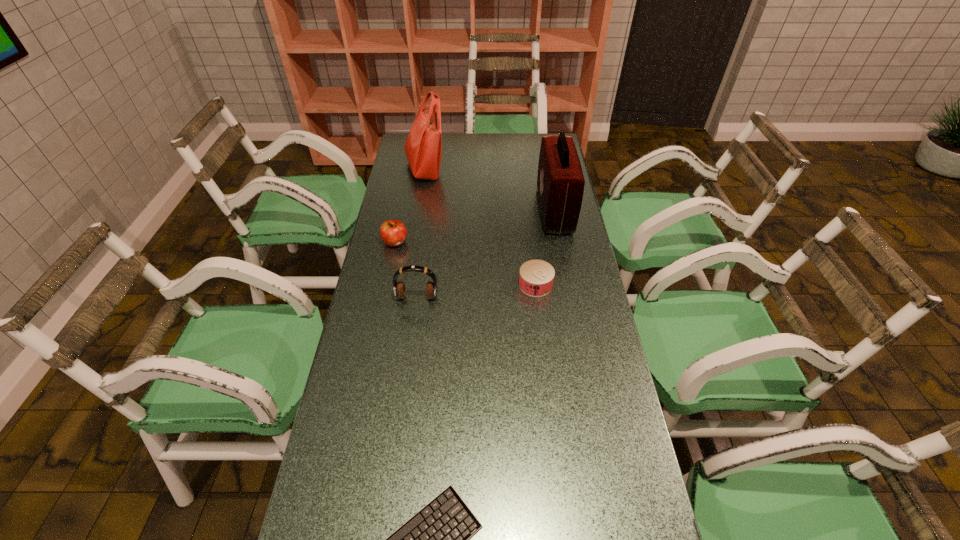
You are a GUI agent. You are given a task and a screenshot of the screen. Output one action in this format:
    pyautogui.click(x=<x>, y=<y>)
    Task: Click on the farthest object
    This screenshot has width=960, height=540.
    Given the screenshot: What is the action you would take?
    pyautogui.click(x=423, y=147)

Identify the location of the first aid kit. (560, 182).

You are a GUI agent. You are given a task and a screenshot of the screen. Output one action in this format:
    pyautogui.click(x=<x>, y=<y>)
    Task: Click on the headset
    The height and width of the screenshot is (540, 960).
    Given the screenshot: What is the action you would take?
    pyautogui.click(x=399, y=290)

Image resolution: width=960 pixels, height=540 pixels. In order to click on the third shortest object in this screenshot , I will do `click(393, 232)`.

Where is `the second shortest object`? The width and height of the screenshot is (960, 540). the second shortest object is located at coordinates (536, 277).

Find the location of `vacant space located on the front-facing side of the farthest object`. vacant space located on the front-facing side of the farthest object is located at coordinates (512, 168).

What are the coordinates of `vacant space positioned on the side of the first aid kit with the cross symbol` in the screenshot? It's located at (444, 210).

Find the location of a particular element. vacant space located on the side of the first aid kit with the cross symbol is located at coordinates (523, 210).

Where is `vacant area located on the side of the first aid kit with the cross symbol`? The image size is (960, 540). vacant area located on the side of the first aid kit with the cross symbol is located at coordinates (461, 210).

Identify the location of free region located on the ear cup of the headset. Image resolution: width=960 pixels, height=540 pixels. (409, 356).